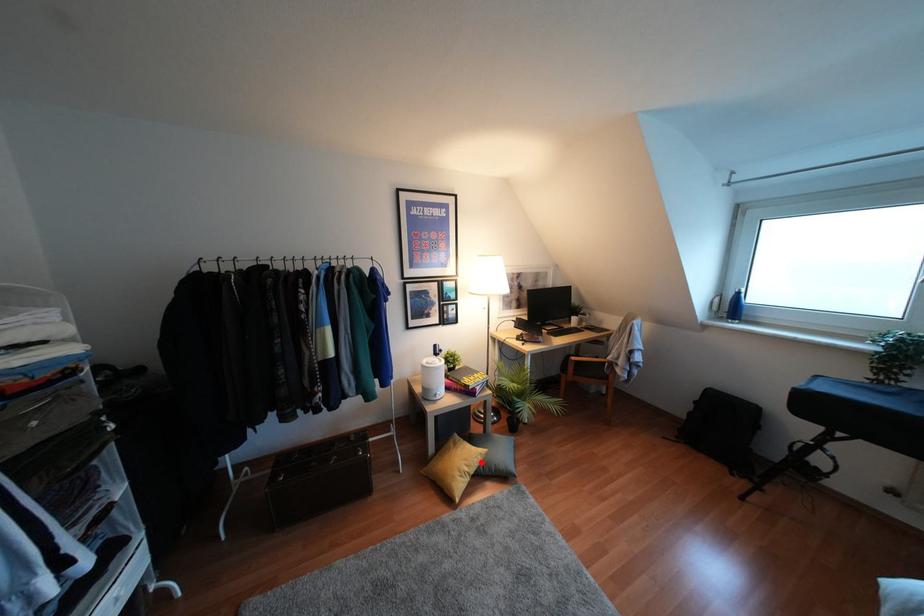
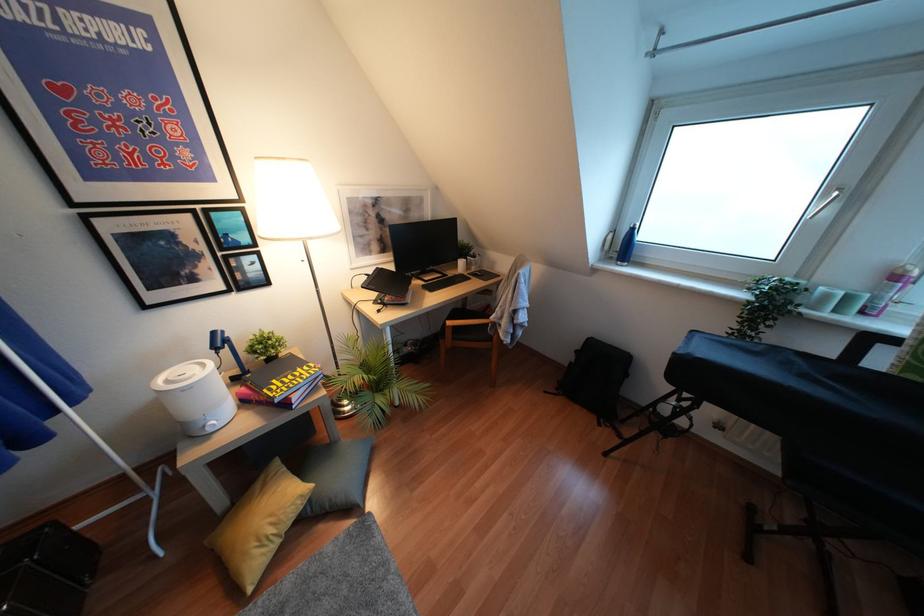
Question: I am providing you with two images of the same scene from different viewpoints. A red point is shown in image1. For the corresponding object point in image2, is it positioned nearer or farther from the camera?

Choices:
 (A) Nearer
 (B) Farther

Answer: (B)